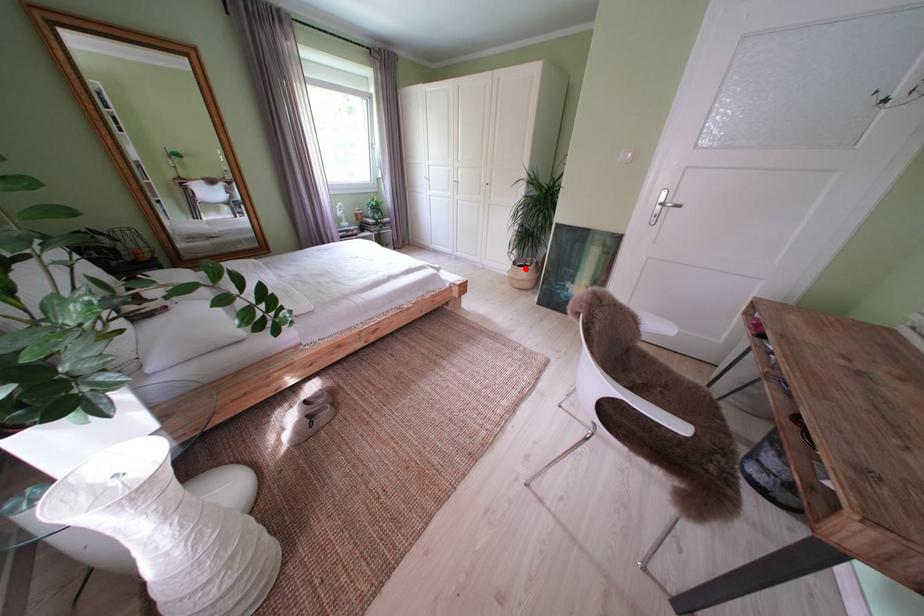
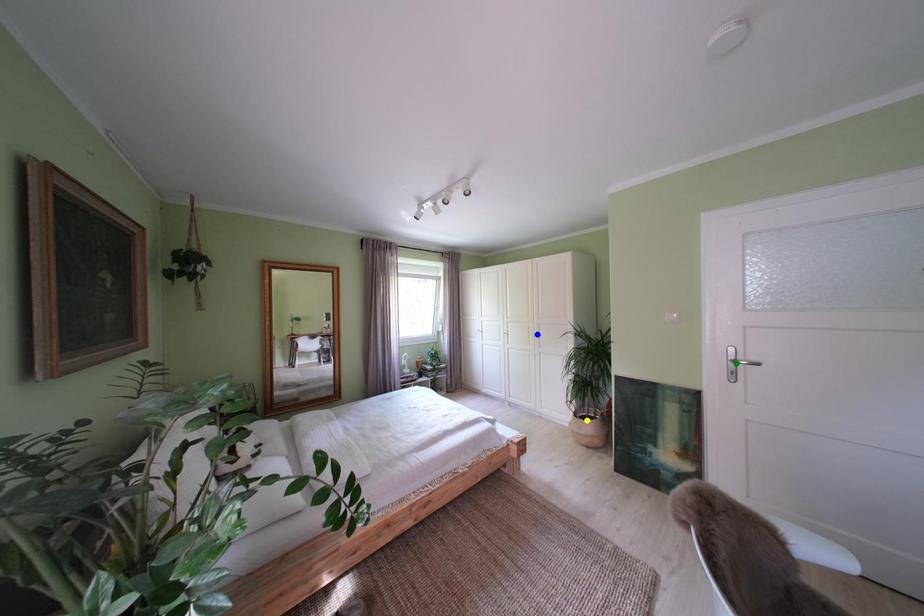
Question: I am providing you with two images of the same scene from different viewpoints. A red point is marked on the first image. You are given multiple points on the second image. Which point in image 2 represents the same 3d spot as the red point in image 1?

Choices:
 (A) yellow point
 (B) blue point
 (C) green point

Answer: (A)